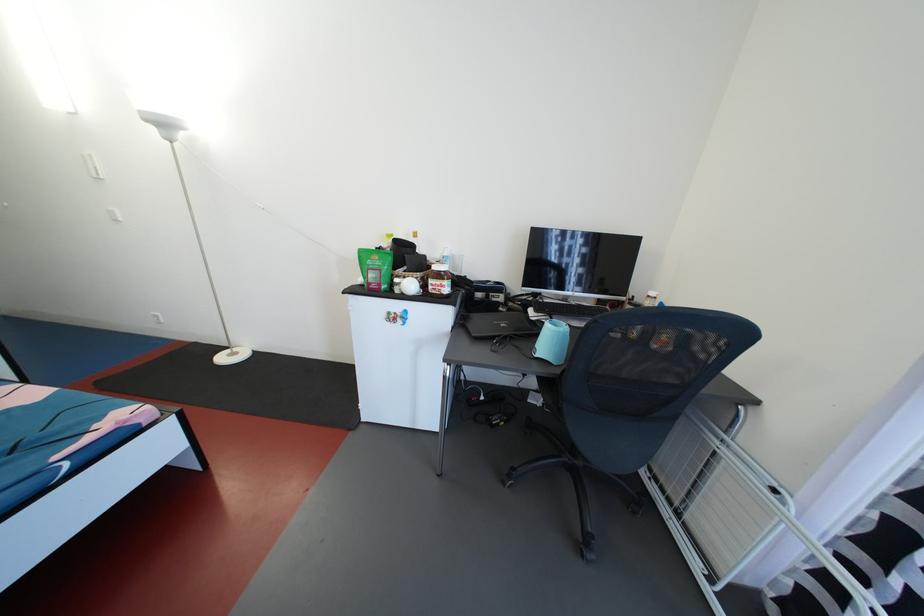
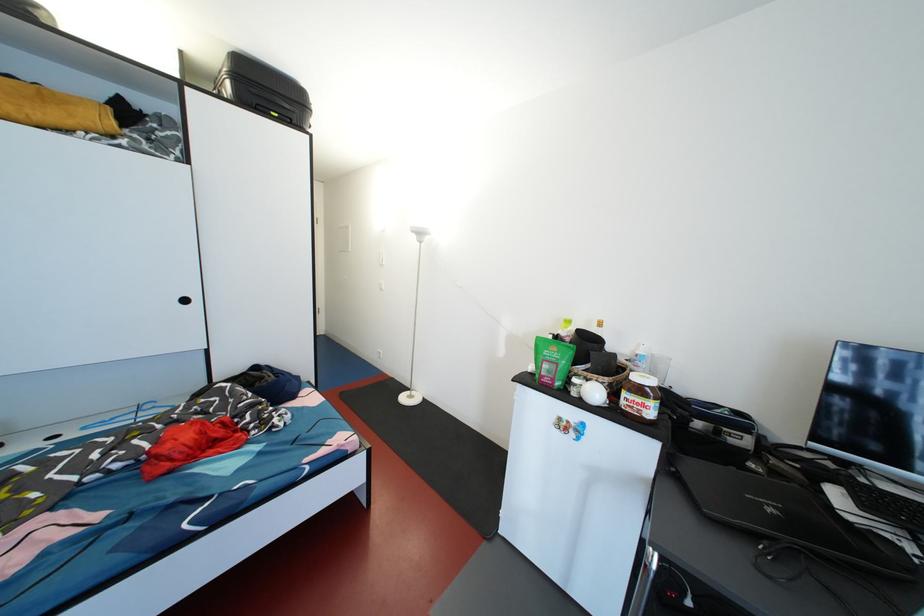
Locate, in the second image, the point that corresponds to pixel 542 315 in the first image.

(869, 511)